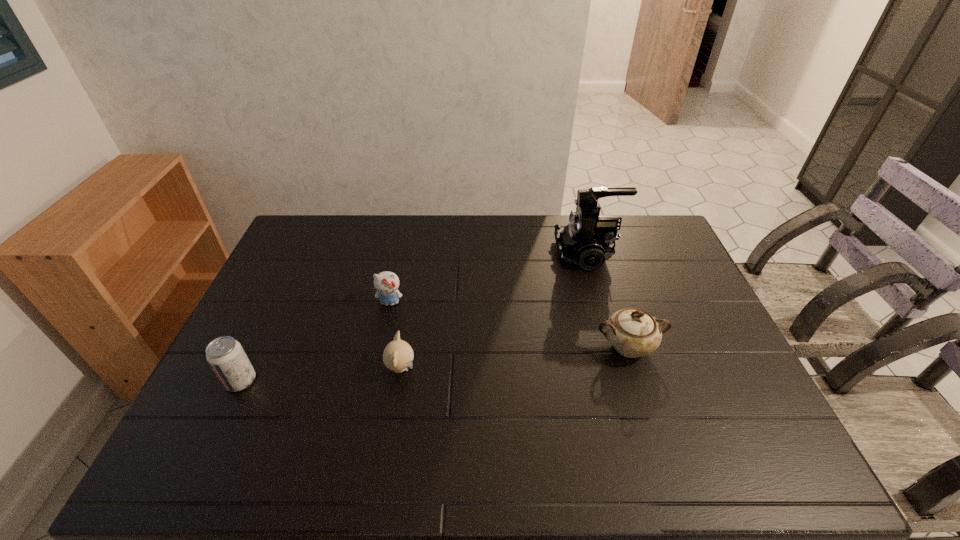
Identify the location of the tallest object. Image resolution: width=960 pixels, height=540 pixels. (587, 240).

At what (x,y) coordinates should I click in order to perform the action: click on the farthest object. Please return your answer as a coordinate pair (x, y). This screenshot has width=960, height=540. Looking at the image, I should click on (587, 240).

Identify the location of chinaware. The width and height of the screenshot is (960, 540). (633, 332).

Find the location of a particular element. the leftmost object is located at coordinates (225, 355).

At what (x,y) coordinates should I click in order to perform the action: click on the second farthest object. Please return your answer as a coordinate pair (x, y). The image size is (960, 540). Looking at the image, I should click on (386, 283).

Locate an element on the screen. Image resolution: width=960 pixels, height=540 pixels. the nearer kitten is located at coordinates (398, 355).

Locate an element on the screen. The height and width of the screenshot is (540, 960). the shortest object is located at coordinates [398, 355].

Locate an element on the screen. vacant area situated on the lens mount of the farthest object is located at coordinates (450, 254).

Locate an element on the screen. vacant region located on the lens mount of the farthest object is located at coordinates (493, 254).

Locate an element on the screen. Image resolution: width=960 pixels, height=540 pixels. free space located on the lens mount of the farthest object is located at coordinates (450, 254).